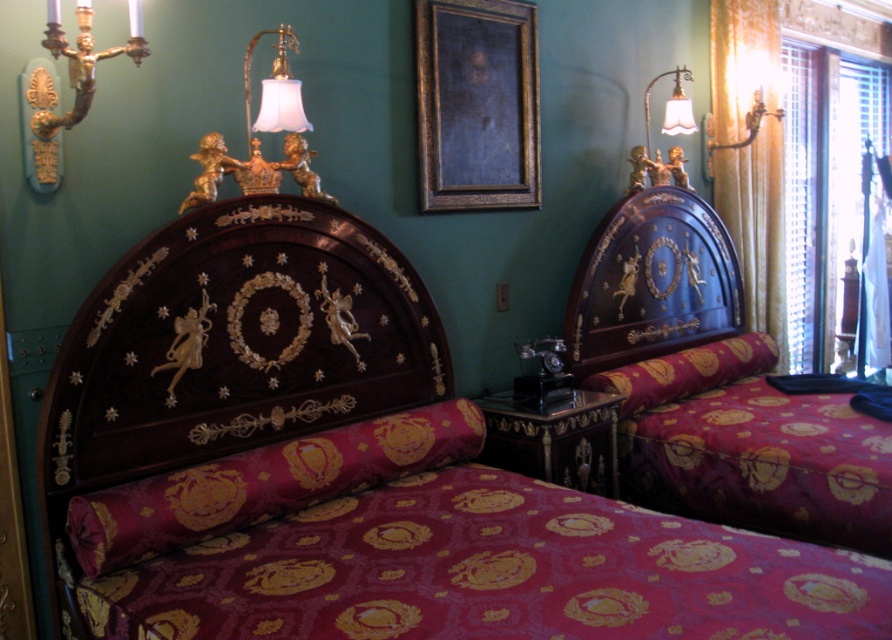
You are arranging flowers in this bedroom and need to place a vase between the velvet burgundy pillow at center and the blue glossy headboard at upper right. According to the scene description, where should you position the vase so it is between these two items?

The velvet burgundy pillow at center is located below the blue glossy headboard at upper right, so to place the vase between them, position it in the middle area between the lower pillow and the upper headboard.

You are arranging flowers in the bedroom and need to place a bouquet that requires a stable, elevated surface. Which object between the velvet burgundy pillow at center and the blue glossy headboard at upper right would be more suitable for placing the bouquet?

The blue glossy headboard at upper right is taller than the velvet burgundy pillow at center, making it a more suitable elevated surface for placing the bouquet.